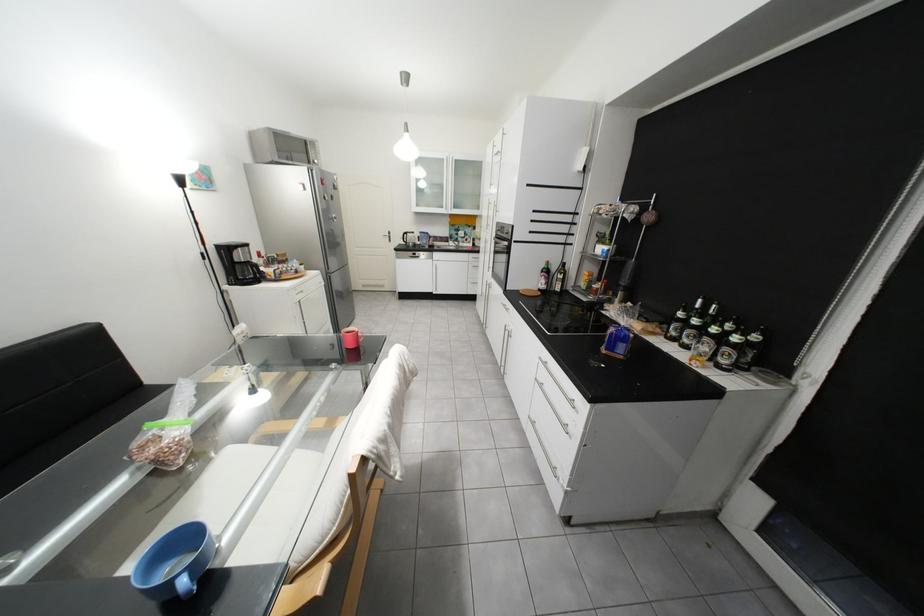
Locate an element on the screen. This screenshot has width=924, height=616. black kettle handle is located at coordinates (407, 237).